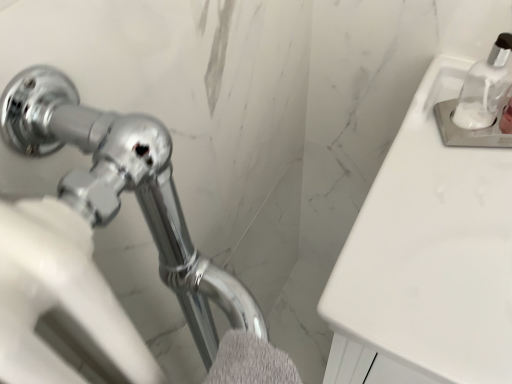
Question: Is the depth of gray fluffy bath towel at lower center greater than that of white glossy sink at upper right?

Choices:
 (A) no
 (B) yes

Answer: (A)

Question: Is gray fluffy bath towel at lower center bigger than white glossy sink at upper right?

Choices:
 (A) no
 (B) yes

Answer: (A)

Question: From the image's perspective, is gray fluffy bath towel at lower center on top of white glossy sink at upper right?

Choices:
 (A) yes
 (B) no

Answer: (B)

Question: From a real-world perspective, does gray fluffy bath towel at lower center stand above white glossy sink at upper right?

Choices:
 (A) no
 (B) yes

Answer: (B)

Question: Can you see gray fluffy bath towel at lower center touching white glossy sink at upper right?

Choices:
 (A) yes
 (B) no

Answer: (B)

Question: Is point click(237, 347) positioned closer to the camera than point click(502, 79)?

Choices:
 (A) closer
 (B) farther

Answer: (A)

Question: Visually, is gray fluffy bath towel at lower center positioned to the left or to the right of clear glass soap dispenser at upper right?

Choices:
 (A) left
 (B) right

Answer: (A)

Question: From their relative heights in the image, would you say gray fluffy bath towel at lower center is taller or shorter than clear glass soap dispenser at upper right?

Choices:
 (A) tall
 (B) short

Answer: (A)

Question: Would you say gray fluffy bath towel at lower center is inside or outside clear glass soap dispenser at upper right?

Choices:
 (A) inside
 (B) outside

Answer: (B)

Question: Considering the positions of white glossy sink at upper right and clear glass soap dispenser at upper right in the image, is white glossy sink at upper right wider or thinner than clear glass soap dispenser at upper right?

Choices:
 (A) wide
 (B) thin

Answer: (A)

Question: Is point (436, 370) closer or farther from the camera than point (500, 94)?

Choices:
 (A) farther
 (B) closer

Answer: (B)

Question: From the image's perspective, is white glossy sink at upper right located above or below clear glass soap dispenser at upper right?

Choices:
 (A) above
 (B) below

Answer: (B)

Question: In terms of height, does white glossy sink at upper right look taller or shorter compared to clear glass soap dispenser at upper right?

Choices:
 (A) short
 (B) tall

Answer: (B)

Question: From the image's perspective, relative to white glossy sink at upper right, is gray fluffy bath towel at lower center above or below?

Choices:
 (A) above
 (B) below

Answer: (B)

Question: Considering their positions, is gray fluffy bath towel at lower center located in front of or behind white glossy sink at upper right?

Choices:
 (A) front
 (B) behind

Answer: (A)